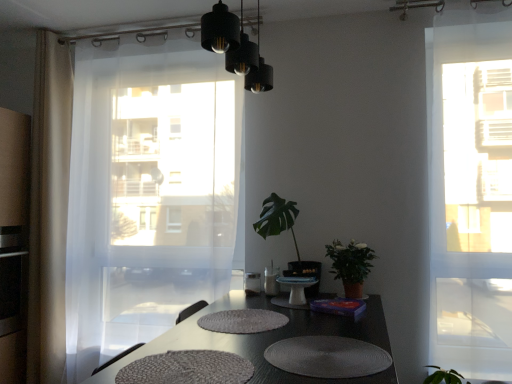
The image size is (512, 384). What are the coordinates of `vacant area on top of beige sheer curtain at left, the 2th curtain when ordered from right to left (from a real-world perspective)` in the screenshot? It's located at (51, 31).